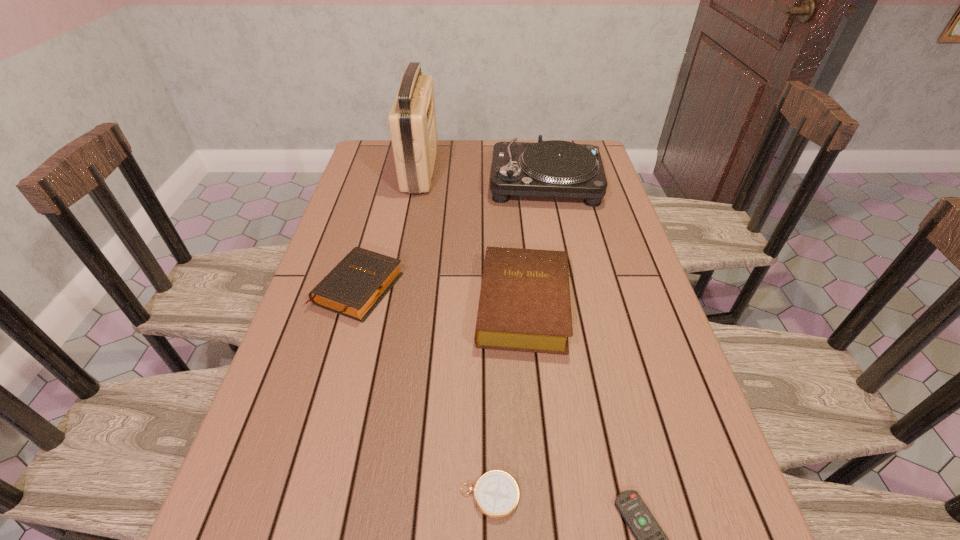
The image size is (960, 540). In the image, there is a desktop. In order to click on vacant space at the left edge in this screenshot , I will do `click(284, 502)`.

This screenshot has height=540, width=960. In the image, there is a desktop. Identify the location of vacant space at the right edge. (582, 263).

Locate an element on the screen. Image resolution: width=960 pixels, height=540 pixels. vacant space at the far left corner is located at coordinates (364, 171).

What are the coordinates of `free space that is in between the right Bible and the tallest object` in the screenshot? It's located at (471, 237).

Find the location of a particular element. empty space that is in between the compass and the left Bible is located at coordinates (424, 392).

Where is `free space between the shorter Bible and the tallest object`? Image resolution: width=960 pixels, height=540 pixels. free space between the shorter Bible and the tallest object is located at coordinates (389, 228).

Locate an element on the screen. free space between the radio receiver and the fifth shortest object is located at coordinates (482, 176).

Find the location of `vacant area that lies between the left Bible and the compass`. vacant area that lies between the left Bible and the compass is located at coordinates (424, 392).

Point out which object is positioned as the second nearest to the fifth tallest object. Please provide its 2D coordinates. Your answer should be formatted as a tuple, i.e. [(x, y)], where the tuple contains the x and y coordinates of a point satisfying the conditions above.

[(524, 305)]

Select which object appears as the fourth closest to the record player. Please provide its 2D coordinates. Your answer should be formatted as a tuple, i.e. [(x, y)], where the tuple contains the x and y coordinates of a point satisfying the conditions above.

[(496, 493)]